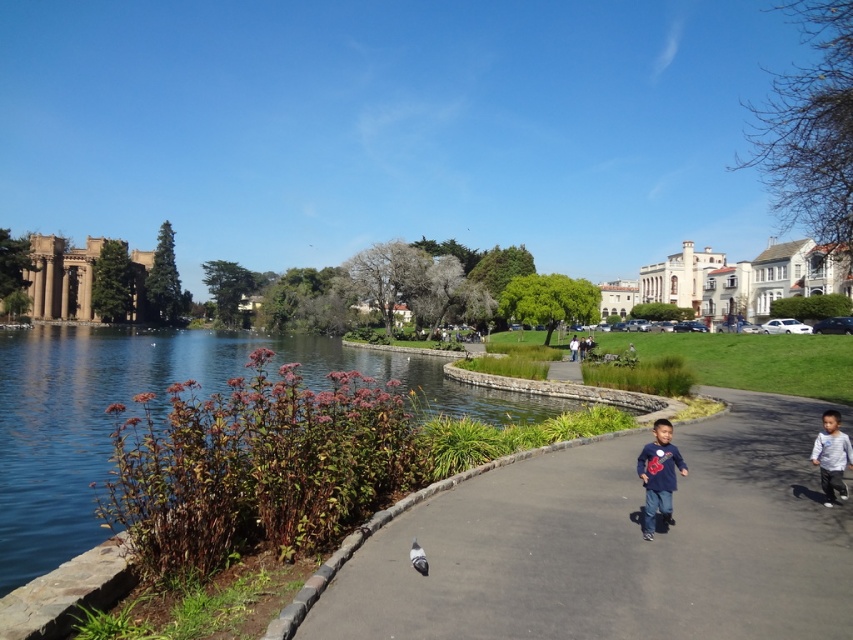
Question: Which point appears farthest from the camera in this image?

Choices:
 (A) (339, 576)
 (B) (419, 556)
 (C) (16, 390)

Answer: (C)

Question: In this image, where is green grassy water at lower left located relative to matte gray pants at center?

Choices:
 (A) left
 (B) right

Answer: (A)

Question: Is green grassy water at lower left above gray matte pigeon at center?

Choices:
 (A) no
 (B) yes

Answer: (B)

Question: Which point appears farthest from the camera in this image?

Choices:
 (A) (688, 544)
 (B) (241, 369)
 (C) (813, 452)
 (D) (590, 337)

Answer: (D)

Question: Which of the following is the closest to the observer?

Choices:
 (A) light gray cotton shirt at lower right
 (B) matte gray pants at center

Answer: (A)

Question: Does smooth asphalt path at center have a lesser width compared to matte gray pants at center?

Choices:
 (A) yes
 (B) no

Answer: (B)